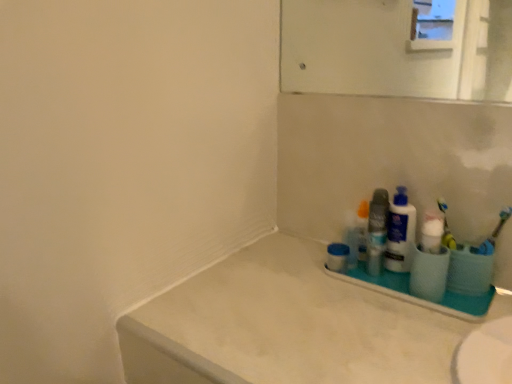
Image resolution: width=512 pixels, height=384 pixels. In order to click on vacant space situated on the left part of white plastic bottle at right, which is the 2th cleaning product in front-to-back order in this screenshot , I will do `click(313, 271)`.